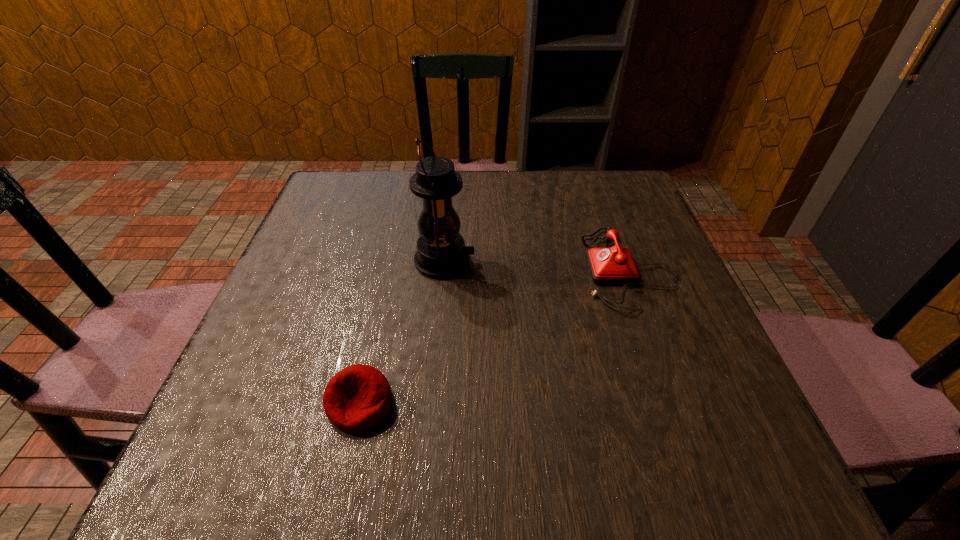
Where is `free space that satisfies the following two spatial constraints: 1. on the dial of the telephone; 2. on the seat area of the beanbag`? free space that satisfies the following two spatial constraints: 1. on the dial of the telephone; 2. on the seat area of the beanbag is located at coordinates (677, 403).

Identify the location of vacant area that satisfies the following two spatial constraints: 1. on the dial of the telephone; 2. on the seat area of the shortest object. The width and height of the screenshot is (960, 540). (677, 403).

You are a GUI agent. You are given a task and a screenshot of the screen. Output one action in this format:
    pyautogui.click(x=<x>, y=<y>)
    Task: Click on the free space that satisfies the following two spatial constraints: 1. above the lantern, indicating its light source; 2. on the seat area of the beanbag
    
    Given the screenshot: What is the action you would take?
    pyautogui.click(x=432, y=403)

Find the location of a particular element. free location that satisfies the following two spatial constraints: 1. above the tallest object, indicating its light source; 2. on the seat area of the nearest object is located at coordinates (432, 403).